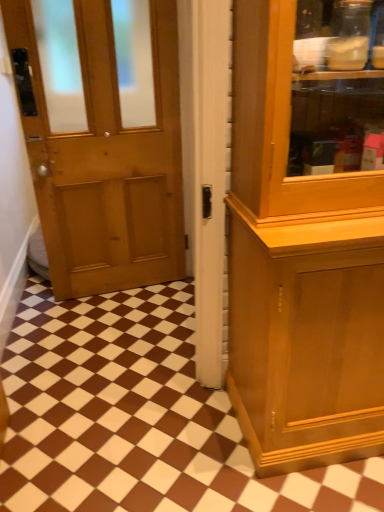
You are a GUI agent. You are given a task and a screenshot of the screen. Output one action in this format:
    pyautogui.click(x=<x>, y=<y>)
    Task: Click on the free spot to the left of matte wood door at center
    
    Given the screenshot: What is the action you would take?
    pyautogui.click(x=45, y=386)